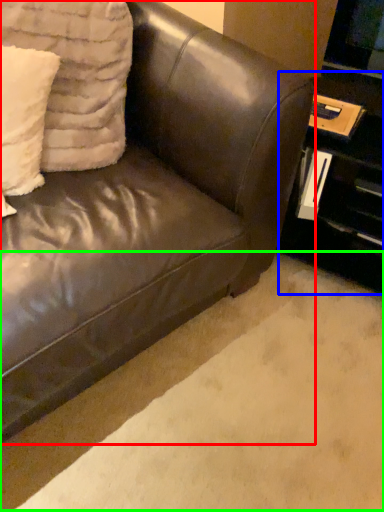
Question: Which object is the closest to the studio couch (highlighted by a red box)? Choose among these: table (highlighted by a blue box) or plain (highlighted by a green box).

Choices:
 (A) table
 (B) plain

Answer: (B)